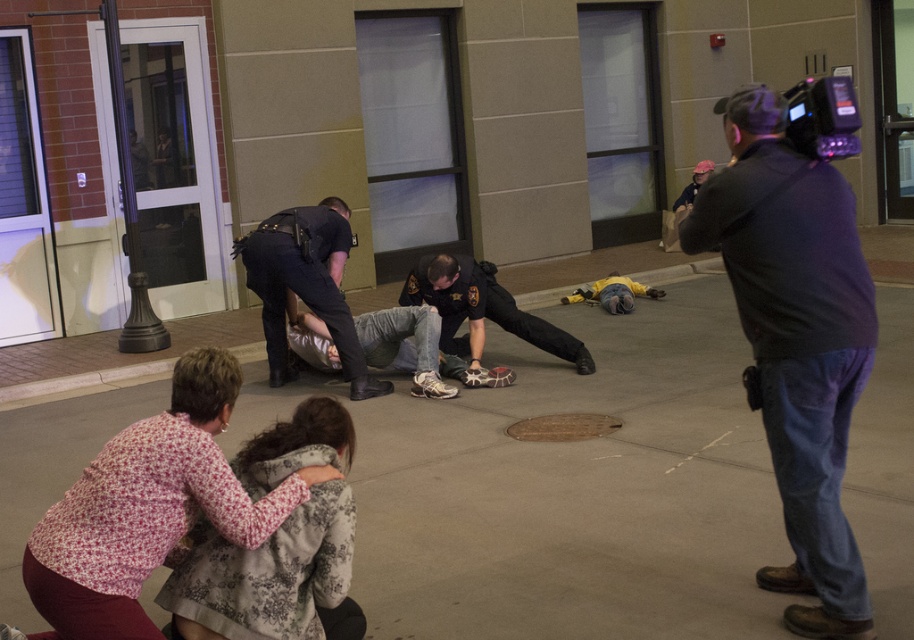
Question: Is dark blue uniform at center smaller than black plastic video camera at upper right?

Choices:
 (A) yes
 (B) no

Answer: (B)

Question: Which of the following is the farthest from the observer?

Choices:
 (A) (x=235, y=376)
 (B) (x=290, y=618)

Answer: (A)

Question: Does concrete at center have a smaller size compared to brown textured manhole cover at center?

Choices:
 (A) no
 (B) yes

Answer: (B)

Question: Which of the following is the closest to the observer?

Choices:
 (A) (228, 417)
 (B) (283, 216)

Answer: (A)

Question: Which object appears farthest from the camera in this image?

Choices:
 (A) black plastic video camera at upper right
 (B) brown textured manhole cover at center

Answer: (B)

Question: Can you confirm if concrete at center is thinner than floral fabric jacket at lower left?

Choices:
 (A) yes
 (B) no

Answer: (A)